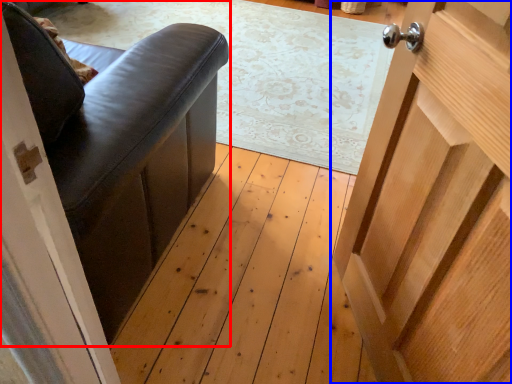
Question: Which object is further to the camera taking this photo, furniture (highlighted by a red box) or door (highlighted by a blue box)?

Choices:
 (A) furniture
 (B) door

Answer: (A)